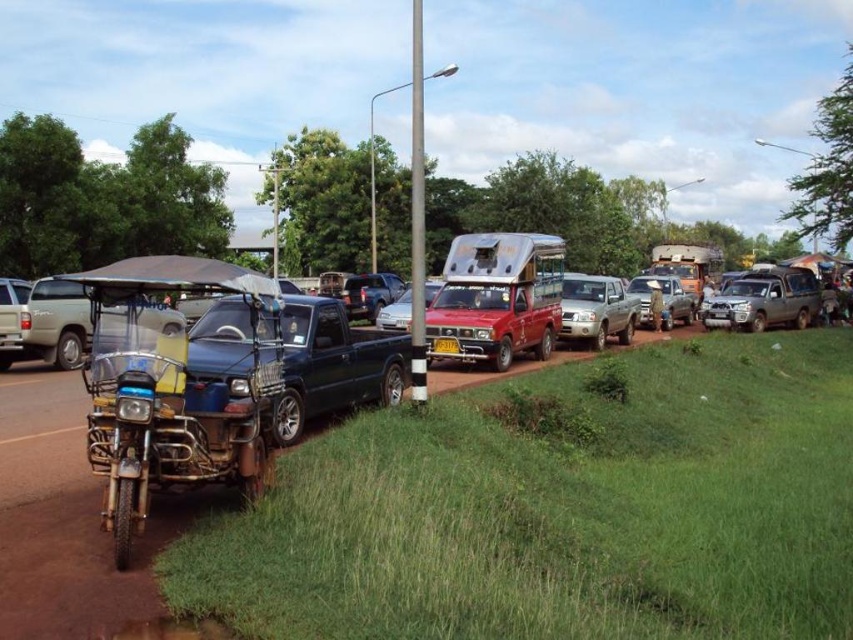
Is point (258, 282) positioned before point (735, 323)?

That is True.

How far apart are metallic blue motorcycle at left and silver metallic suv at right?

They are 86.75 feet apart.

The image size is (853, 640). What do you see at coordinates (173, 387) in the screenshot?
I see `metallic blue motorcycle at left` at bounding box center [173, 387].

The height and width of the screenshot is (640, 853). I want to click on metallic blue motorcycle at left, so click(173, 387).

Looking at this image, which is above, metallic motorcycle at lower left or yellow plastic license plate at center?

Positioned higher is yellow plastic license plate at center.

Can you confirm if metallic motorcycle at lower left is positioned below yellow plastic license plate at center?

Indeed, metallic motorcycle at lower left is positioned under yellow plastic license plate at center.

Is point (51, 433) closer to camera compared to point (450, 340)?

Yes, point (51, 433) is closer to viewer.

This screenshot has width=853, height=640. What are the coordinates of `metallic motorcycle at lower left` in the screenshot? It's located at 41,435.

Which is more to the right, satin silver sedan at center or metallic motorcycle at lower left?

satin silver sedan at center is more to the right.

What do you see at coordinates (396, 312) in the screenshot?
I see `satin silver sedan at center` at bounding box center [396, 312].

You are a GUI agent. You are given a task and a screenshot of the screen. Output one action in this format:
    pyautogui.click(x=<x>, y=<y>)
    Task: Click on the satin silver sedan at center
    The image size is (853, 640).
    Given the screenshot: What is the action you would take?
    pyautogui.click(x=396, y=312)